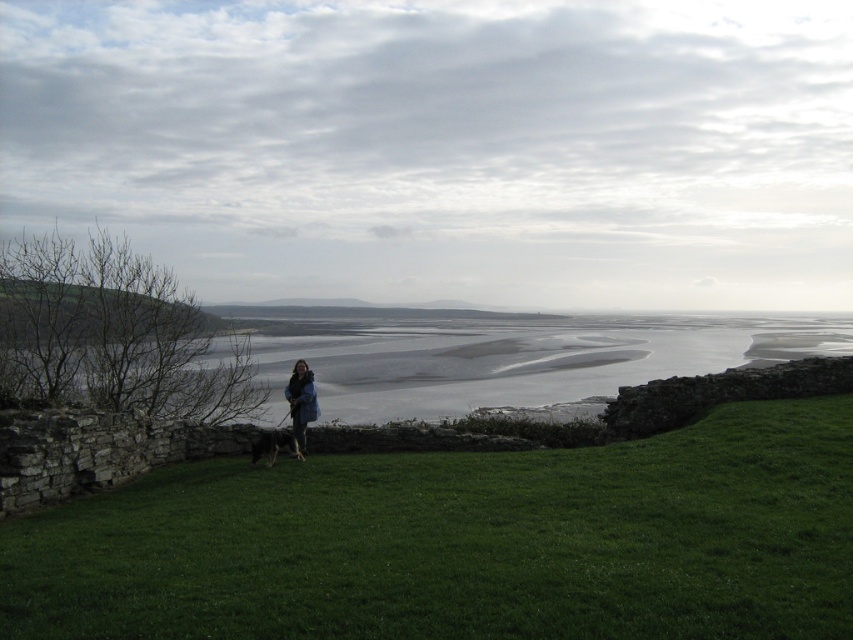
Question: Is green grassy at lower center behind brown fur dog at center?

Choices:
 (A) yes
 (B) no

Answer: (B)

Question: Does green grassy at lower center come in front of dark blue jacket at center?

Choices:
 (A) yes
 (B) no

Answer: (A)

Question: Among these points, which one is farthest from the camera?

Choices:
 (A) (821, 352)
 (B) (303, 433)
 (C) (283, 436)

Answer: (A)

Question: Which point is farther to the camera?

Choices:
 (A) (628, 632)
 (B) (273, 449)
 (C) (294, 364)

Answer: (C)

Question: Does green grassy at lower center appear on the left side of gray sand at lower center?

Choices:
 (A) no
 (B) yes

Answer: (B)

Question: Estimate the real-world distances between objects in this image. Which object is closer to the dark blue jacket at center?

Choices:
 (A) green grassy at lower center
 (B) gray sand at lower center
 (C) brown fur dog at center

Answer: (C)